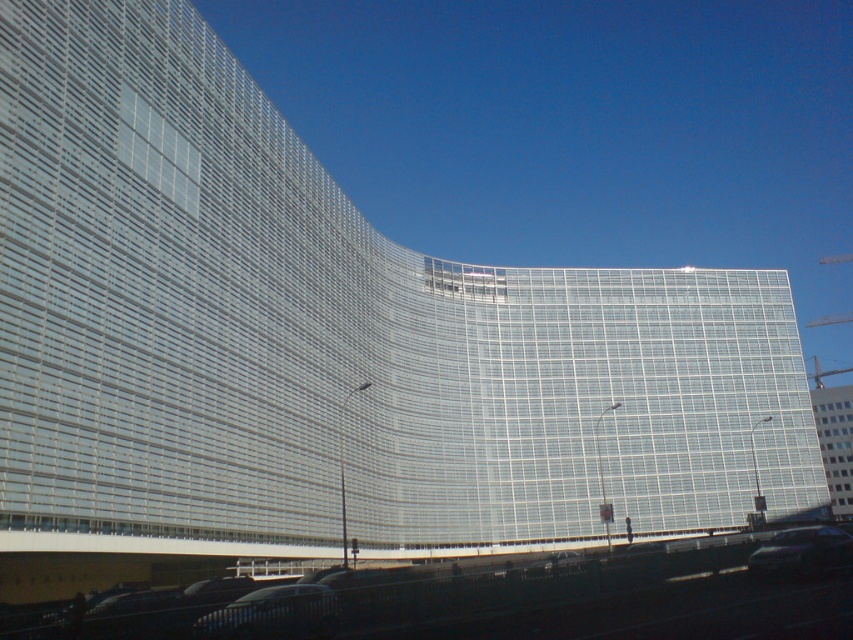
You are standing in front of the modern curved building and notice two points marked on the glass facade. The first point is at coordinates point (0, 605) and the second is at point (219, 637). Which point appears closer to you when looking at the building?

Point (0, 605) is further to the camera than point (219, 637), so the point (219, 637) appears closer to you.